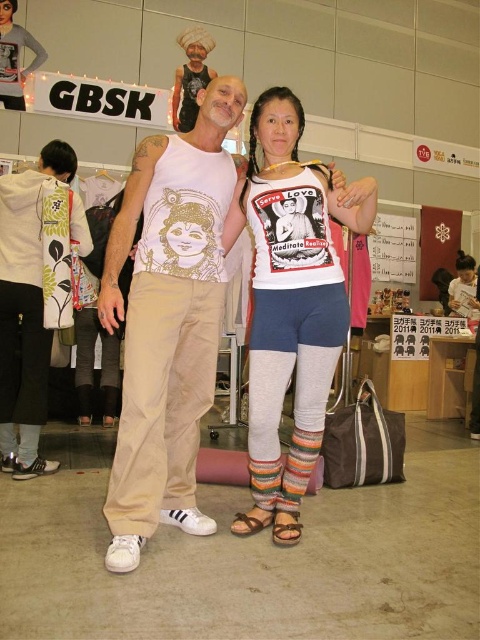
Is point (175, 376) less distant than point (37, 314)?

Yes, point (175, 376) is in front of point (37, 314).

Measure the distance between beige cotton tank top at center and white floral-patterned hoodie at lower left.

They are 3.61 feet apart.

Locate an element on the screen. beige cotton tank top at center is located at coordinates tap(168, 321).

Is point (113, 472) farther from viewer compared to point (275, 500)?

That is False.

Who is positioned more to the right, beige cotton tank top at center or white cotton t-shirt at center?

From the viewer's perspective, white cotton t-shirt at center appears more on the right side.

Image resolution: width=480 pixels, height=640 pixels. What do you see at coordinates (168, 321) in the screenshot?
I see `beige cotton tank top at center` at bounding box center [168, 321].

I want to click on beige cotton tank top at center, so click(x=168, y=321).

Is the position of white cotton t-shirt at center more distant than that of white floral-patterned hoodie at lower left?

No.

Looking at this image, which is above, white cotton t-shirt at center or white floral-patterned hoodie at lower left?

white floral-patterned hoodie at lower left is higher up.

Is point (289, 115) positioned after point (74, 170)?

No, it is not.

The height and width of the screenshot is (640, 480). I want to click on white cotton t-shirt at center, so click(x=290, y=304).